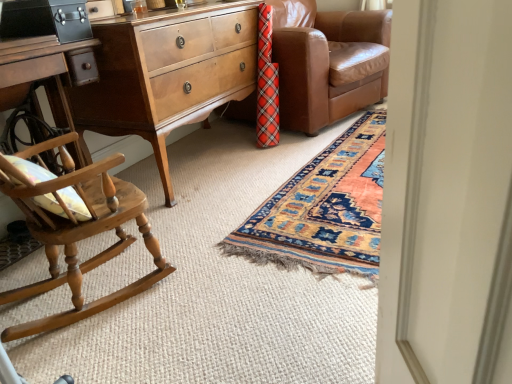
Question: Based on their positions, is brown leather couch at center located to the left or right of wooden rocking chair at left?

Choices:
 (A) right
 (B) left

Answer: (A)

Question: Do you think brown leather couch at center is within wooden rocking chair at left, or outside of it?

Choices:
 (A) outside
 (B) inside

Answer: (A)

Question: Considering the real-world distances, which object is farthest from the wooden rocking chair at left?

Choices:
 (A) black leather briefcase at upper left
 (B) light brown wood nightstand at left
 (C) brown leather couch at center

Answer: (C)

Question: Estimate the real-world distances between objects in this image. Which object is farther from the black leather briefcase at upper left?

Choices:
 (A) brown leather couch at center
 (B) wooden rocking chair at left
 (C) light brown wood nightstand at left

Answer: (A)